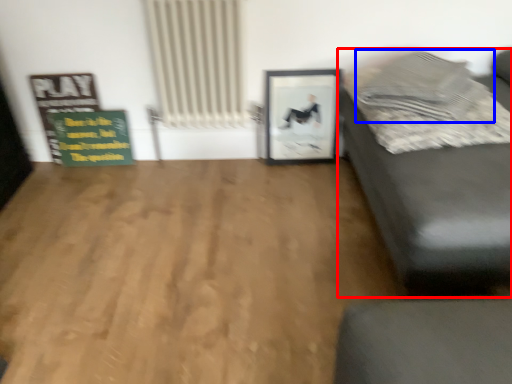
Question: Among these objects, which one is farthest to the camera, studio couch (highlighted by a red box) or pillow (highlighted by a blue box)?

Choices:
 (A) studio couch
 (B) pillow

Answer: (B)